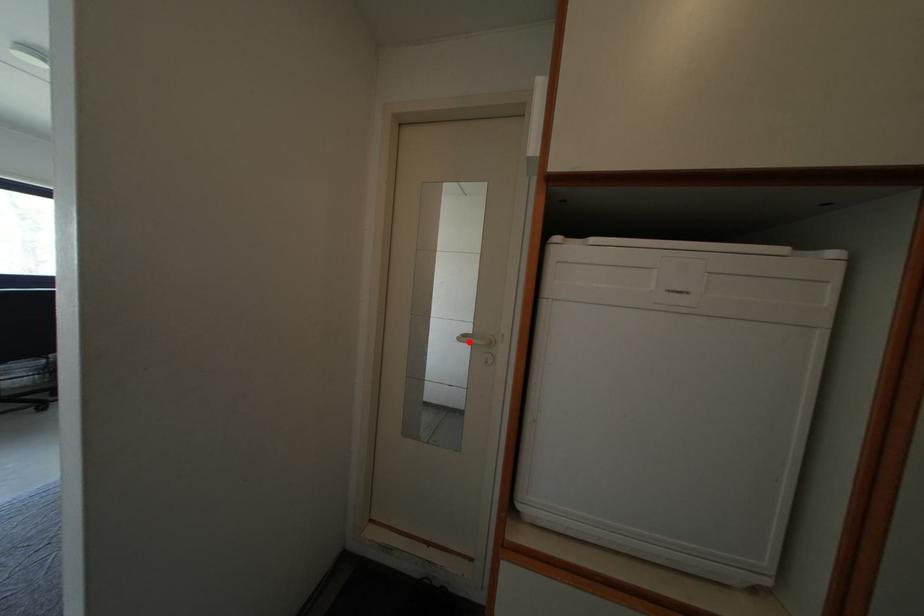
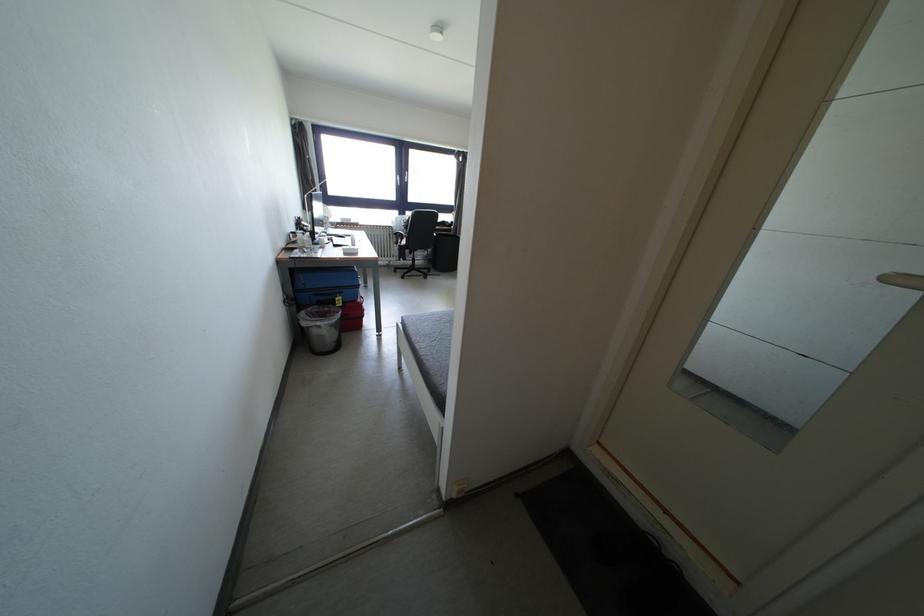
Find the pixel in the second image that matches the highlighted location in the first image.

(898, 284)